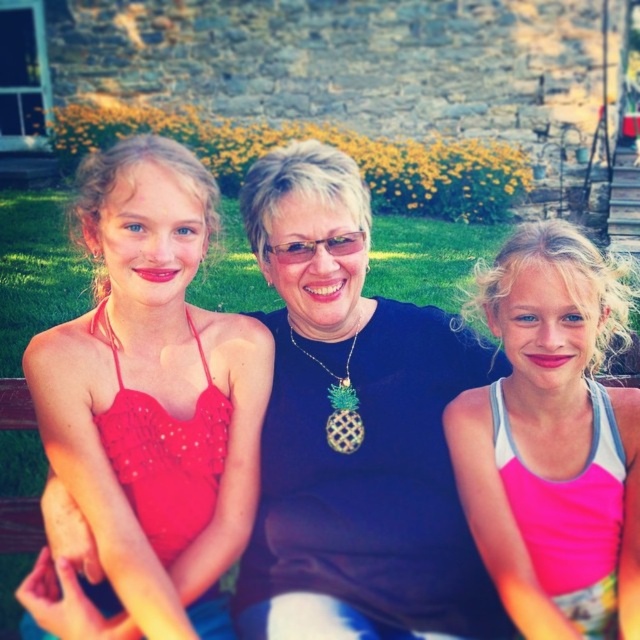
You are a photographer trying to capture a photo of the two people wearing the matte red dress at left and the pink fabric tank top at center. Based on their positions, which one should you focus on first if you want to ensure both are in the frame?

The matte red dress at left is located below the pink fabric tank top at center, so you should focus on the pink fabric tank top at center first to ensure both are in the frame.

Looking at this image, you are a photographer trying to capture a clear shot of the matte red dress at left and the pink fabric tank top at center. Which one will appear larger in your photo?

The matte red dress at left is further to the viewer than the pink fabric tank top at center, so it will appear larger in the photo.